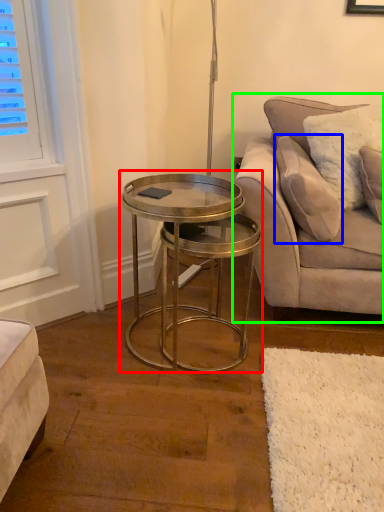
Question: Estimate the real-world distances between objects in this image. Which object is closer to coffee table (highlighted by a red box), pillow (highlighted by a blue box) or studio couch (highlighted by a green box)?

Choices:
 (A) pillow
 (B) studio couch

Answer: (B)